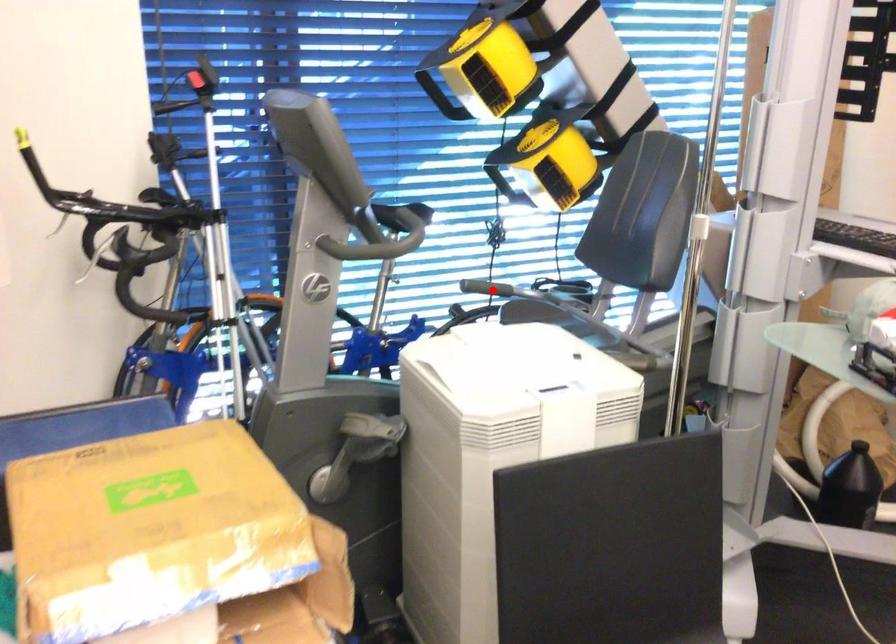
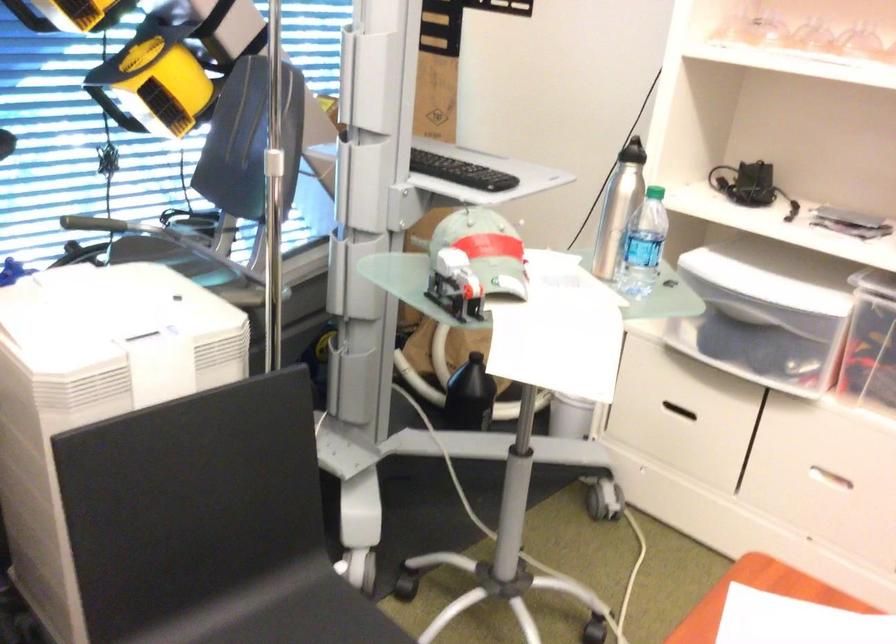
Question: I am providing you with two images of the same scene from different viewpoints. Given a red point in image1, look at the same physical point in image2. Is it:

Choices:
 (A) Closer to the viewpoint
 (B) Farther from the viewpoint

Answer: (A)